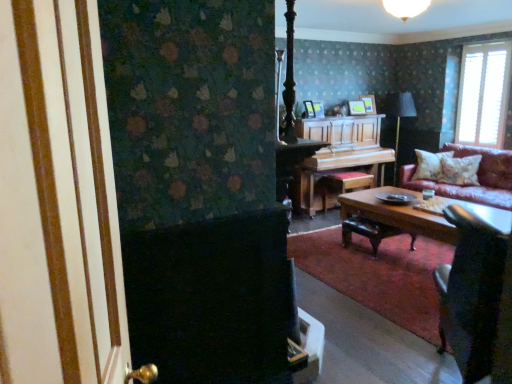
This screenshot has height=384, width=512. I want to click on vacant space to the left of wooden stool at center, so click(x=318, y=217).